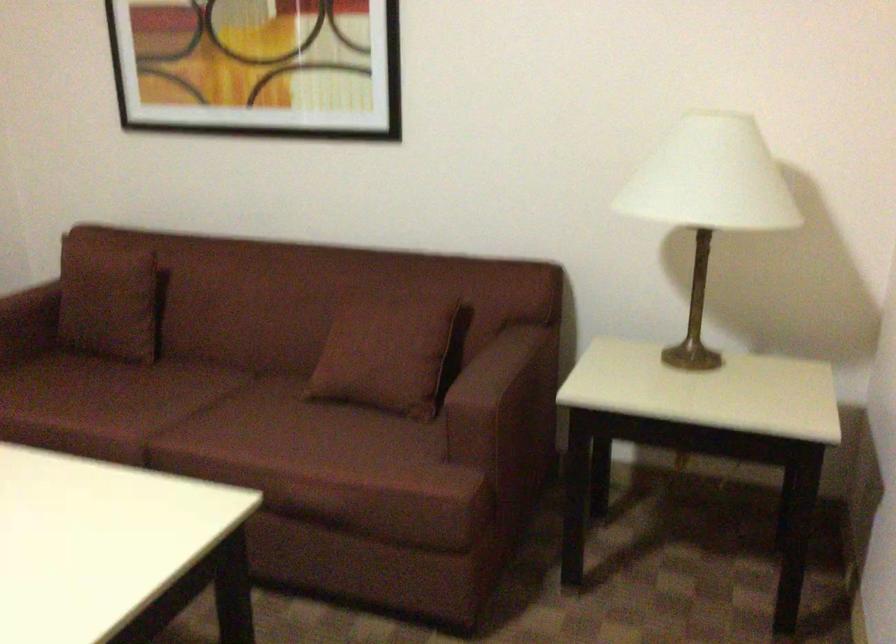
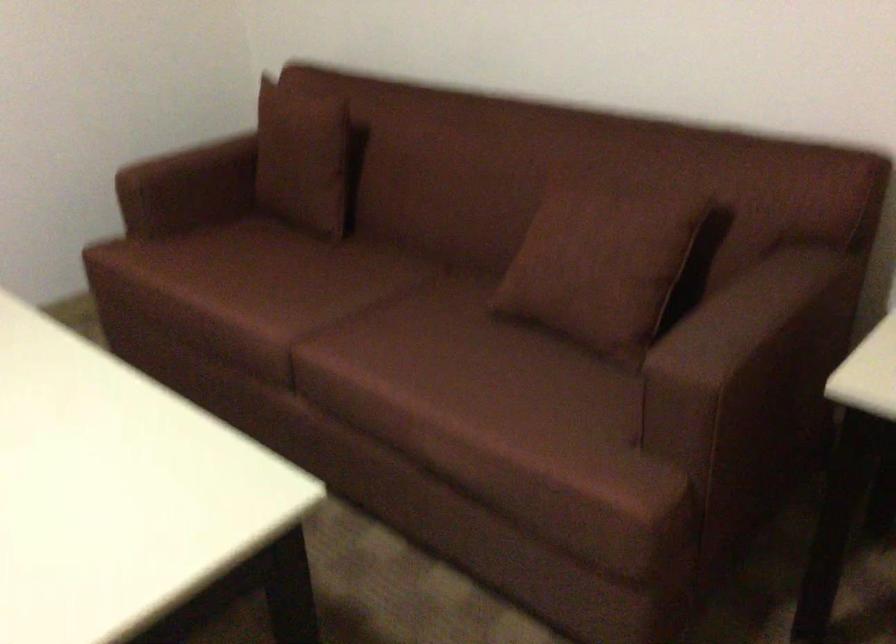
Find the pixel in the second image that matches the point at 117,399 in the first image.

(286, 283)